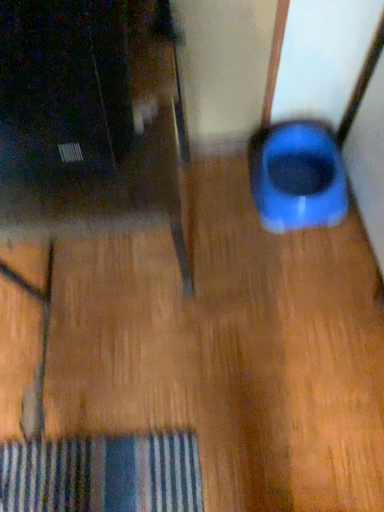
This screenshot has height=512, width=384. Find the location of `vacant space positioned to the left of blue glossy toilet at lower right`. vacant space positioned to the left of blue glossy toilet at lower right is located at coordinates (218, 206).